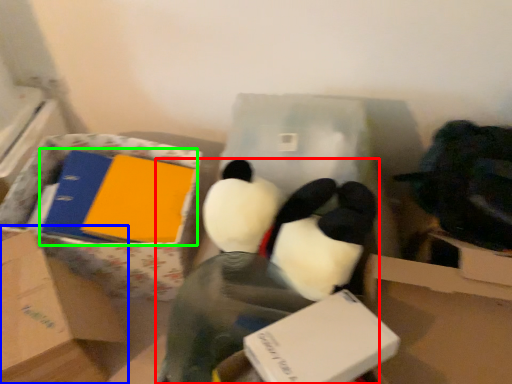
Question: Estimate the real-world distances between objects in this image. Which object is farther from toy (highlighted by a red box), box (highlighted by a blue box) or book (highlighted by a green box)?

Choices:
 (A) box
 (B) book

Answer: (A)